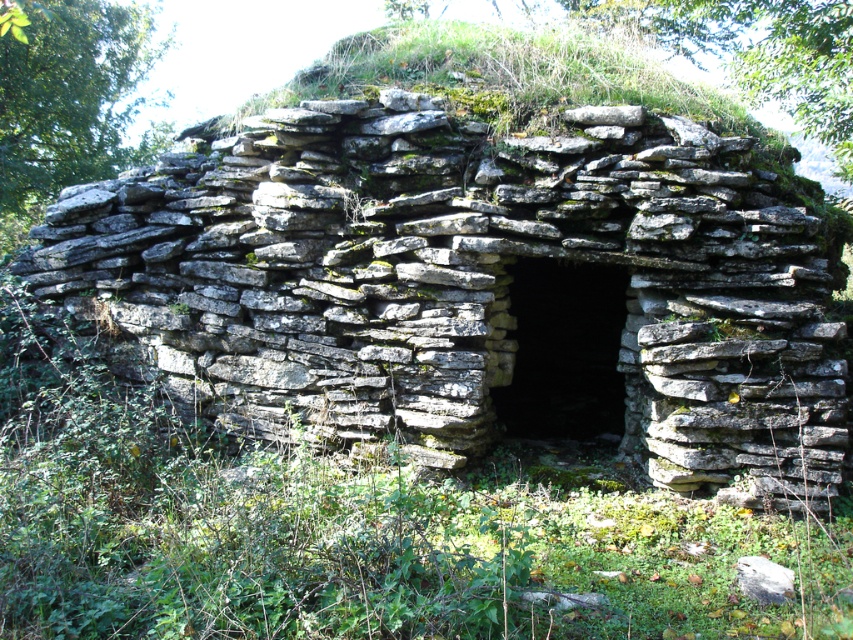
From the picture: You are an archaeologist exploring the ancient stone structure. You need to place a 10 feet long measuring tape from the gray stone wall at center to the green mossy grass at center. Will the tape be long enough to reach both objects?

The distance between the gray stone wall at center and the green mossy grass at center is 8.43 feet. Since the measuring tape is 10 feet long, it will be long enough to reach both objects.

You are an archaeologist examining the ancient stone structure. You notice the gray stone wall at center and the green mossy grass at center. Which object is wider?

The gray stone wall at center is wider than the green mossy grass at center.

You are an explorer standing at the entrance of the ancient stone structure. You notice two features at the center of the scene. Which one is taller between the gray stone wall at center and the green mossy grass at center?

The gray stone wall at center is taller than the green mossy grass at center according to the description.